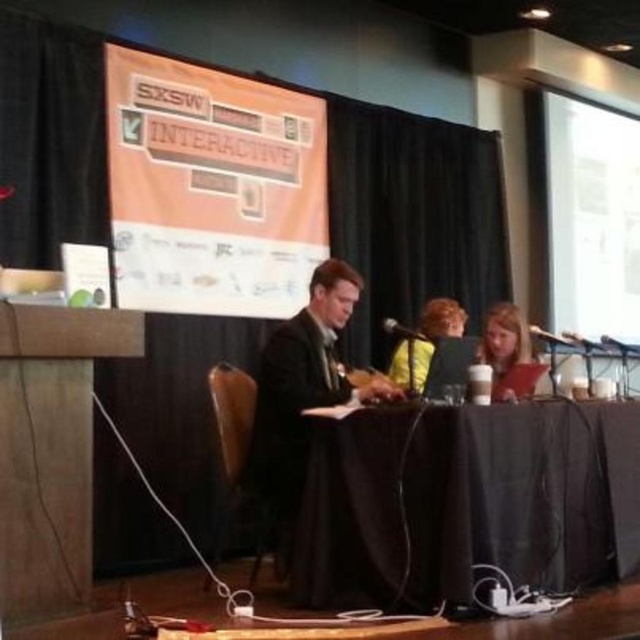
You are attending the SXSW Interactive event and notice two items in the scene. The orange fabric banner at upper center and the blonde hair at center. Which of these two items is bigger in size?

The orange fabric banner at upper center is larger in size than the blonde hair at center.

You are standing at the front of the SXSW Interactive conference room and want to adjust the orange fabric banner at upper center. If your arm reaches 6 feet, can you reach it without moving closer?

The orange fabric banner at upper center is 12.54 feet from the camera, which is beyond the 6 feet reach of your arm. Therefore, you cannot reach it without moving closer.

You are attending the SXSW Interactive conference and notice two elements in the image. The orange fabric banner at upper center and the blonde hair at center. Which of these two elements is located to the left of the other?

The orange fabric banner at upper center is positioned on the left side of blonde hair at center.